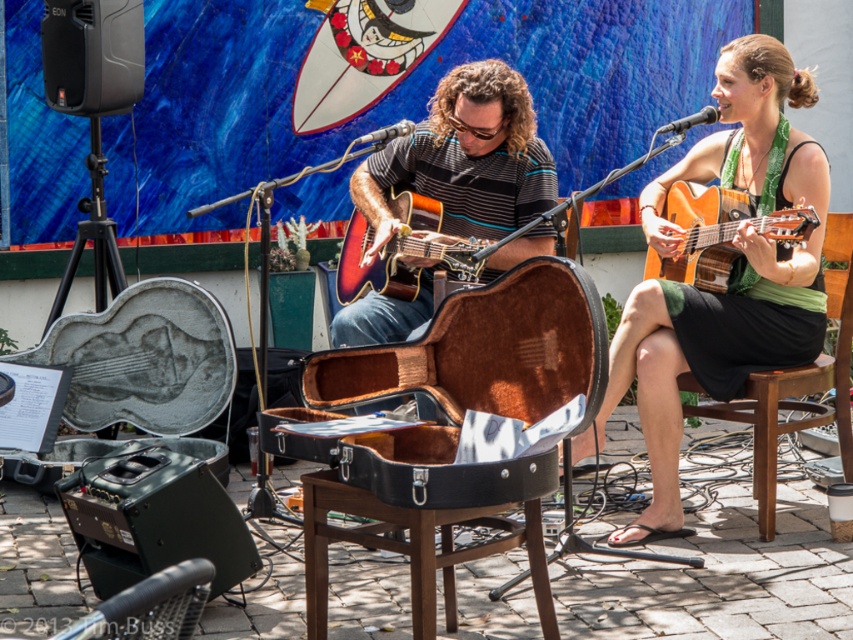
Between green fabric dress at center and acoustic wood guitar at right, which one appears on the right side from the viewer's perspective?

acoustic wood guitar at right

Looking at this image, can you confirm if green fabric dress at center is bigger than acoustic wood guitar at right?

Indeed, green fabric dress at center has a larger size compared to acoustic wood guitar at right.

The width and height of the screenshot is (853, 640). What do you see at coordinates (732, 273) in the screenshot?
I see `green fabric dress at center` at bounding box center [732, 273].

Find the location of a particular element. The width and height of the screenshot is (853, 640). green fabric dress at center is located at coordinates (732, 273).

Who is more distant from viewer, (824, 234) or (672, 195)?

The point (672, 195) is more distant.

This screenshot has width=853, height=640. What do you see at coordinates (799, 385) in the screenshot? I see `wooden chair at center` at bounding box center [799, 385].

Who is more distant from viewer, (845, 388) or (698, 218)?

The point (845, 388) is behind.

Where is `wooden chair at center`? wooden chair at center is located at coordinates (799, 385).

Is green fabric dress at center thinner than sunburst wood guitar at center?

Incorrect, green fabric dress at center's width is not less than sunburst wood guitar at center's.

Find the location of a particular element. This screenshot has width=853, height=640. green fabric dress at center is located at coordinates (732, 273).